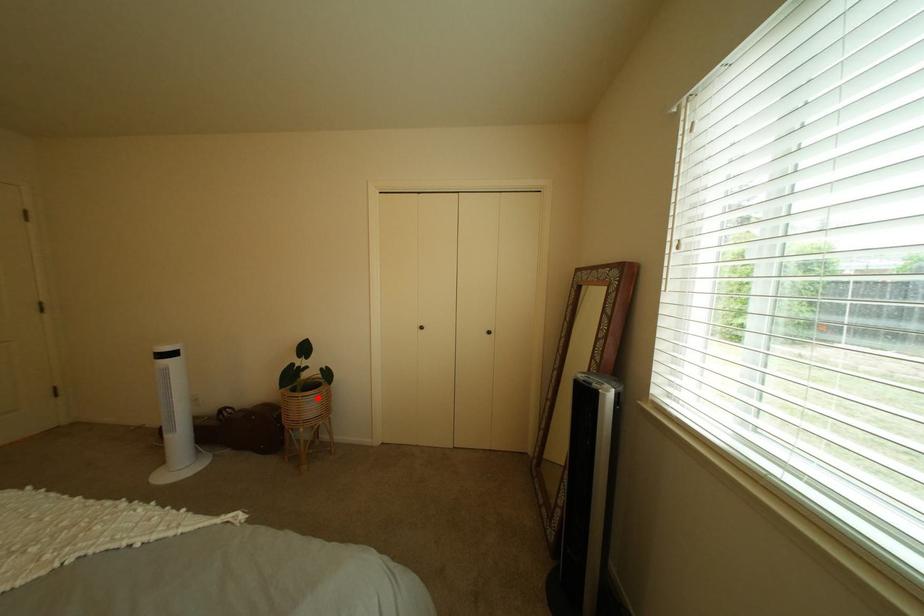
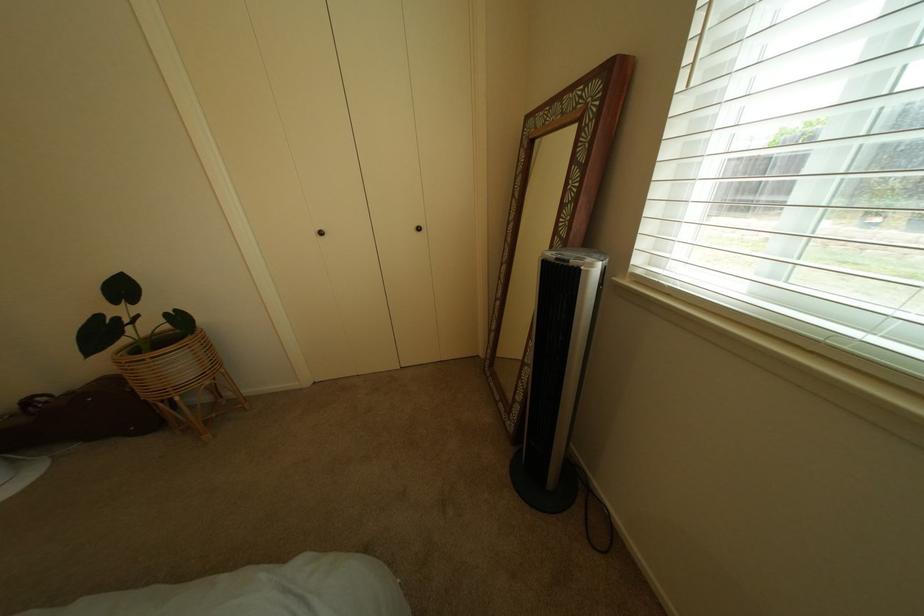
Find the pixel in the second image that matches the highlighted location in the first image.

(167, 359)